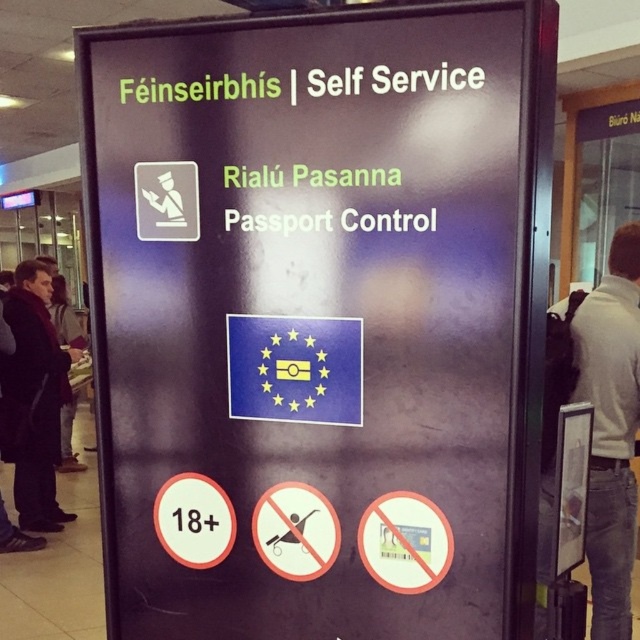
Is point (616, 406) positioned in front of point (28, 468)?

Yes, point (616, 406) is in front of point (28, 468).

The image size is (640, 640). What do you see at coordinates (611, 428) in the screenshot?
I see `white shirt at center` at bounding box center [611, 428].

Consider the image. Who is more forward, (621, 276) or (10, 368)?

Point (621, 276) is in front.

The height and width of the screenshot is (640, 640). Find the location of `white shirt at center`. white shirt at center is located at coordinates (611, 428).

Does matte black sign at center have a greater height compared to white shirt at center?

Incorrect, matte black sign at center's height is not larger of white shirt at center's.

What do you see at coordinates (323, 310) in the screenshot? The image size is (640, 640). I see `matte black sign at center` at bounding box center [323, 310].

Where is `matte black sign at center`? This screenshot has height=640, width=640. matte black sign at center is located at coordinates (323, 310).

Which is in front, point (305, 166) or point (196, 474)?

Positioned in front is point (305, 166).

The width and height of the screenshot is (640, 640). Find the location of `matte black sign at center`. matte black sign at center is located at coordinates (323, 310).